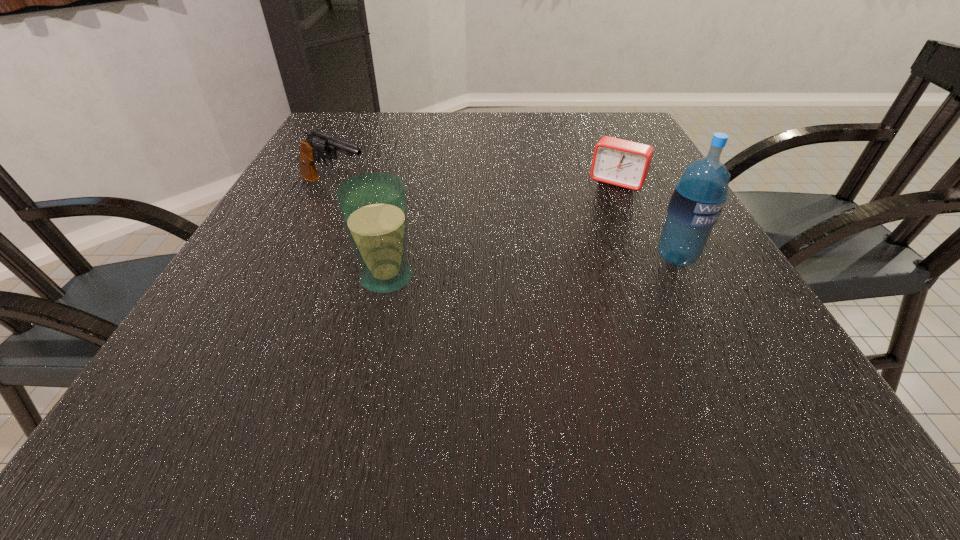
What are the coordinates of `vacant space on the desktop that is between the second object from left to right and the tallest object and is positioned on the front-facing side of the alarm clock` in the screenshot? It's located at (564, 265).

The width and height of the screenshot is (960, 540). What are the coordinates of `free spot on the desktop that is between the glass and the tallest object and is positioned along the barrel of the leftmost object` in the screenshot? It's located at tap(525, 268).